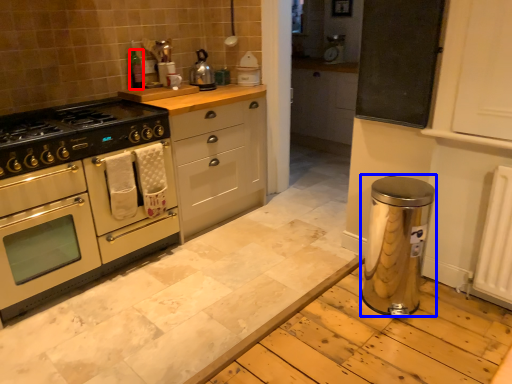
Question: Among these objects, which one is farthest to the camera, bottle (highlighted by a red box) or water heater (highlighted by a blue box)?

Choices:
 (A) bottle
 (B) water heater

Answer: (A)